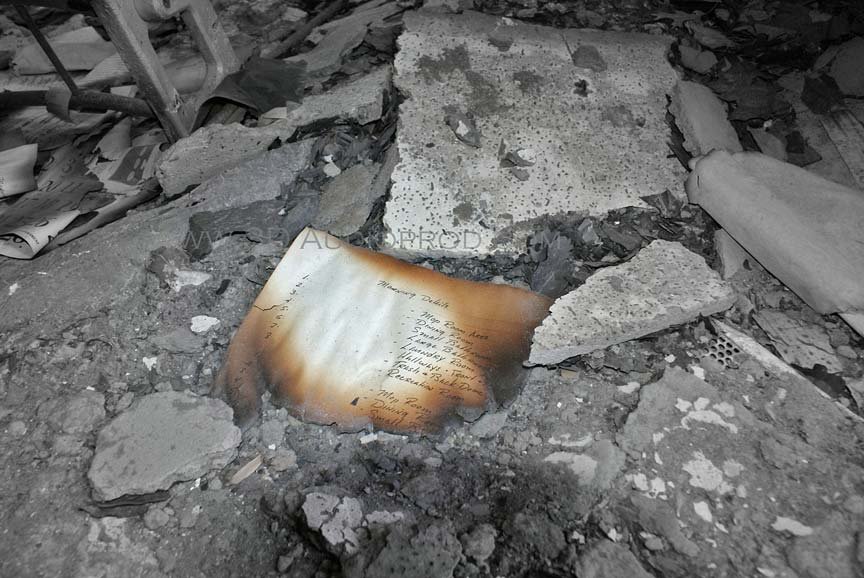
I want to click on newspaper, so click(28, 234), click(129, 171).